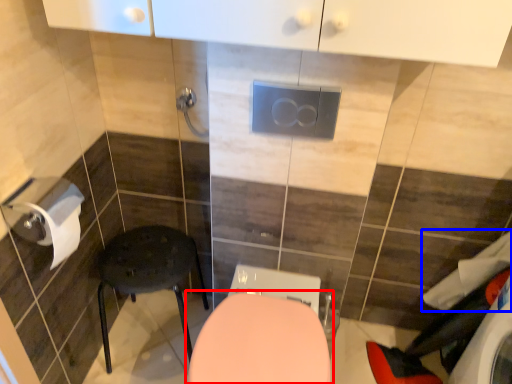
Question: Which object appears closest to the camera in this image, toilet (highlighted by a red box) or laundry (highlighted by a blue box)?

Choices:
 (A) toilet
 (B) laundry

Answer: (A)